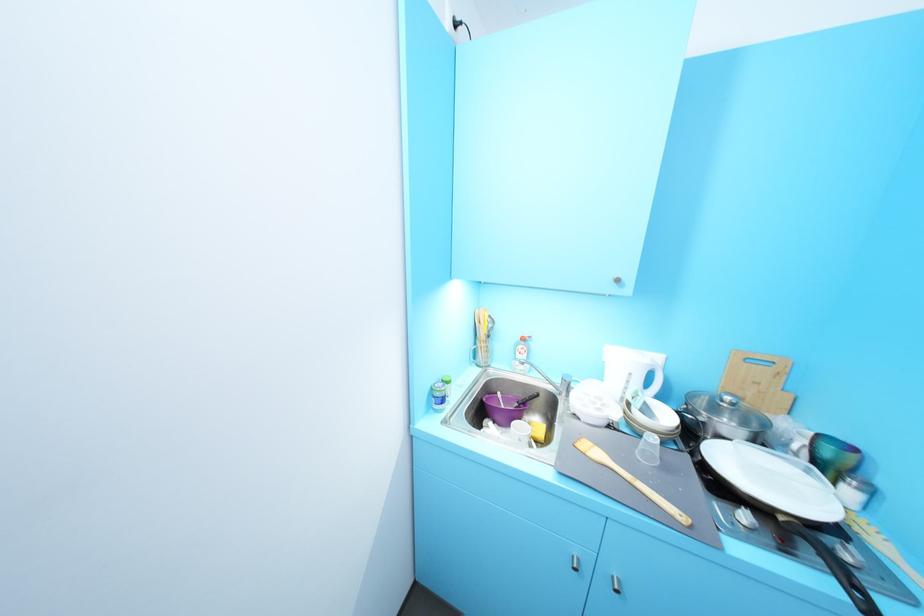
You are a GUI agent. You are given a task and a screenshot of the screen. Output one action in this format:
    pyautogui.click(x=<x>, y=<y>)
    Task: Click on the red detergent bottle
    Image resolution: width=924 pixels, height=616 pixels.
    Given the screenshot: What is the action you would take?
    pyautogui.click(x=520, y=355)